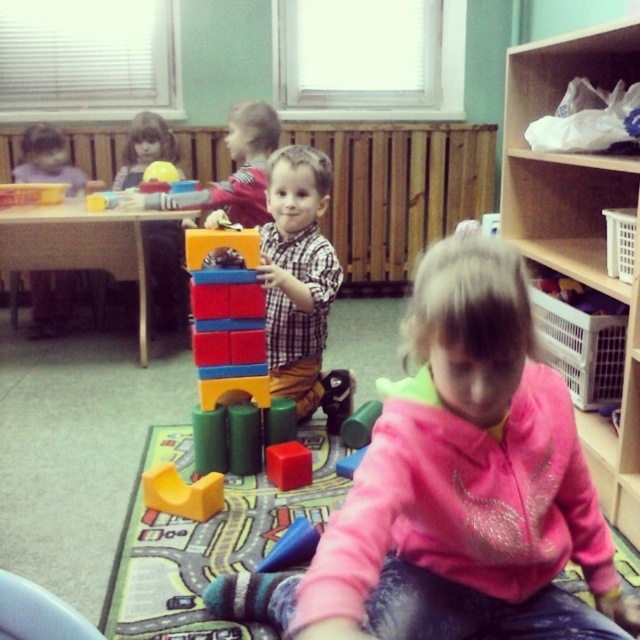
Is point (176, 477) closer to camera compared to point (268, 557)?

That is False.

Is point (147, 468) positioned behind point (282, 554)?

Yes, point (147, 468) is behind point (282, 554).

At what (x,y) coordinates should I click in order to perform the action: click on yellow matte block at center. Please return your answer as a coordinate pair (x, y). This screenshot has height=640, width=640. Looking at the image, I should click on (180, 492).

What are the coordinates of `checkered fabric shirt at center` in the screenshot? It's located at (296, 273).

Can you confirm if checkered fabric shirt at center is bigger than rubberized blue car at center?

Yes, checkered fabric shirt at center is bigger than rubberized blue car at center.

The width and height of the screenshot is (640, 640). What are the coordinates of `checkered fabric shirt at center` in the screenshot? It's located at (296, 273).

The height and width of the screenshot is (640, 640). I want to click on checkered fabric shirt at center, so click(296, 273).

Can you confirm if smooth plastic head at upper left is bigger than rubberized blue car at center?

Indeed, smooth plastic head at upper left has a larger size compared to rubberized blue car at center.

Is point (131, 172) positioned behind point (304, 536)?

Yes, it is behind point (304, 536).

Is point (157, 125) closer to viewer compared to point (284, 547)?

No, (157, 125) is behind (284, 547).

The height and width of the screenshot is (640, 640). What are the coordinates of `smooth plastic head at upper left` in the screenshot? It's located at (144, 148).